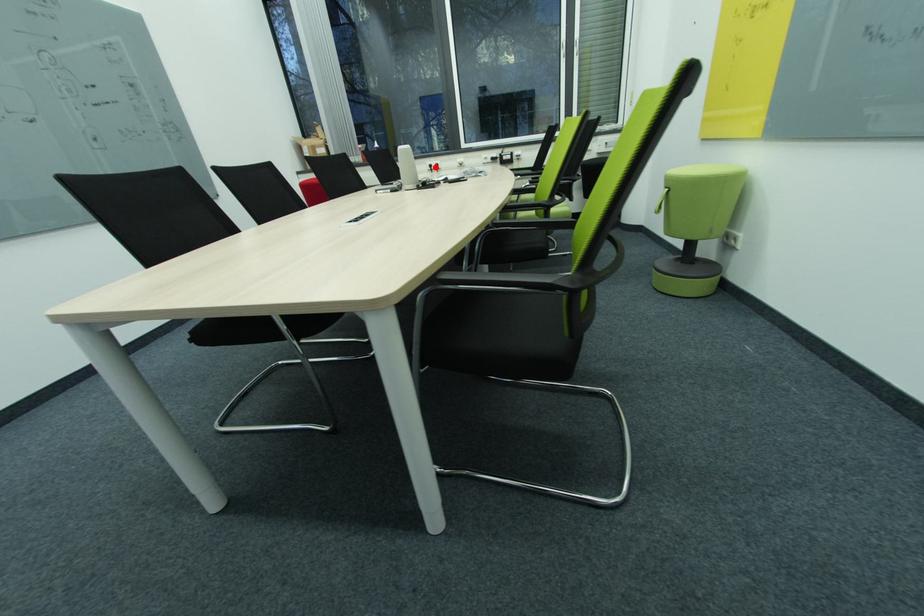
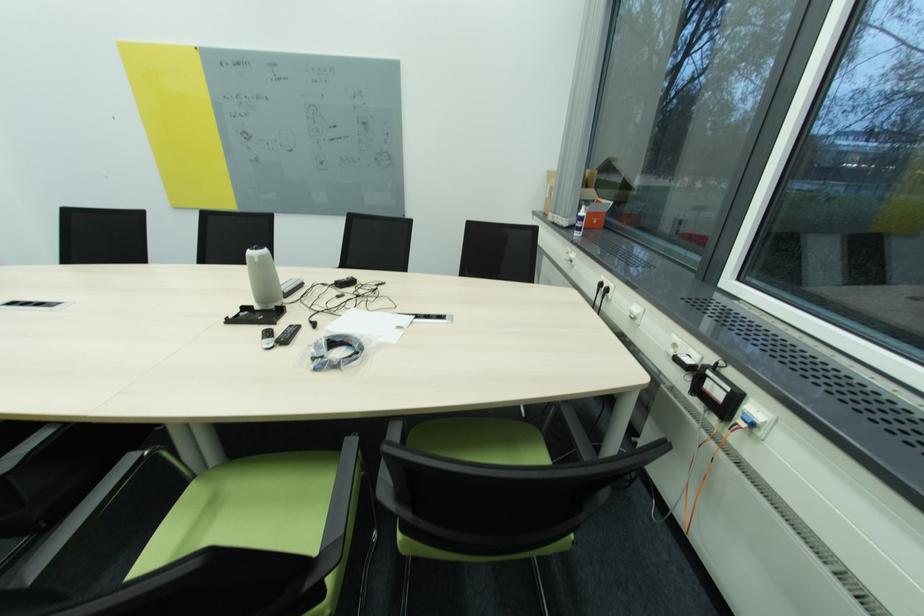
Locate, in the second image, the point that corresponds to the highlighted location in the first image.

(604, 286)